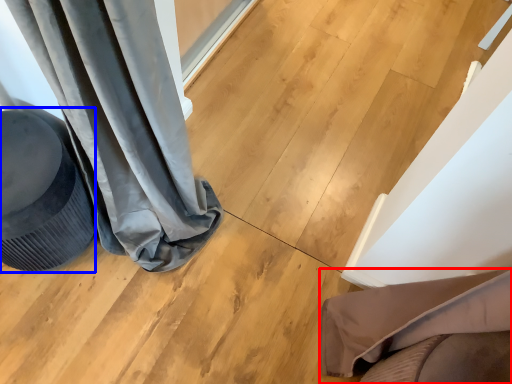
Question: Which object appears farthest to the camera in this image, furniture (highlighted by a red box) or swivel chair (highlighted by a blue box)?

Choices:
 (A) furniture
 (B) swivel chair

Answer: (B)